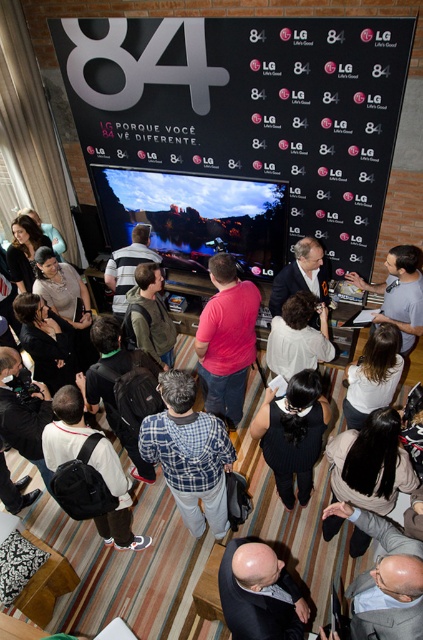
You are a photographer at the event and want to capture both the dark suit at center and the striped shirt at center in a single photo. Which one should you focus on first to ensure both are in frame?

The dark suit at center is below striped shirt at center, so you should focus on the striped shirt at center first to ensure both are in frame.